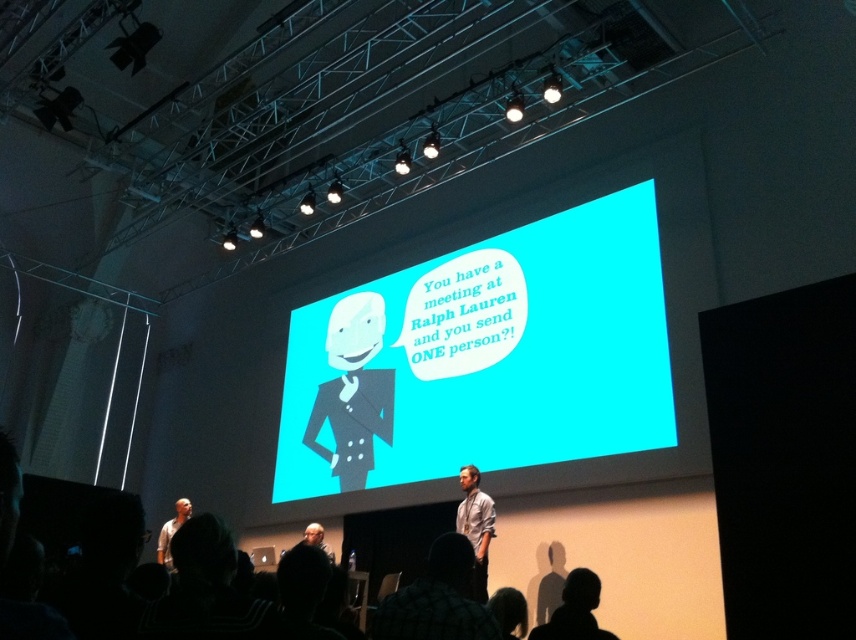
Based on the photo, you are an event photographer positioned at the back of the venue. You need to capture a photo of both the matte black suit at center and the light blue shirt at center. Which subject should you frame first in your camera viewfinder to ensure they are both in the shot?

The matte black suit at center is to the left of light blue shirt at center. Therefore, you should frame the matte black suit at center first on the left side of the viewfinder, then adjust to include the light blue shirt at center on the right side.

You are an event coordinator setting up the stage for a presentation. You need to ensure that the matte blue screen at center is visible to the audience without being blocked by the matte black suit at center. Based on the scene description, can you confirm if the screen is positioned in a way that it won not be obscured by the suit?

The matte blue screen at center is located above the matte black suit at center, so it will not be obscured by the suit and should remain visible to the audience.